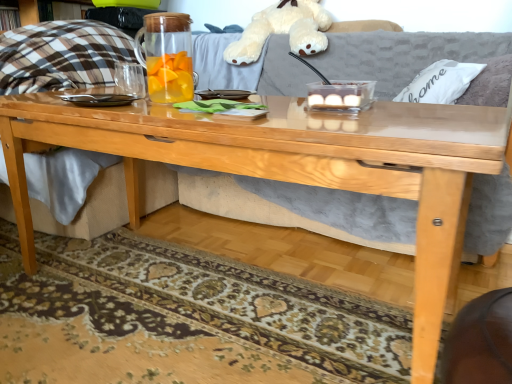
Question: Can you confirm if white plush toy at upper center is smaller than patterned carpet at lower center?

Choices:
 (A) no
 (B) yes

Answer: (A)

Question: From a real-world perspective, does white plush toy at upper center stand above patterned carpet at lower center?

Choices:
 (A) no
 (B) yes

Answer: (B)

Question: Is the depth of white plush toy at upper center greater than that of patterned carpet at lower center?

Choices:
 (A) yes
 (B) no

Answer: (A)

Question: From the image's perspective, is white plush toy at upper center located above patterned carpet at lower center?

Choices:
 (A) yes
 (B) no

Answer: (A)

Question: Is white plush toy at upper center aimed at patterned carpet at lower center?

Choices:
 (A) no
 (B) yes

Answer: (A)

Question: From their relative heights in the image, would you say white plush toy at upper center is taller or shorter than patterned carpet at lower center?

Choices:
 (A) tall
 (B) short

Answer: (A)

Question: Visually, is white plush toy at upper center positioned to the left or to the right of patterned carpet at lower center?

Choices:
 (A) right
 (B) left

Answer: (A)

Question: From a real-world perspective, relative to patterned carpet at lower center, is white plush toy at upper center vertically above or below?

Choices:
 (A) below
 (B) above

Answer: (B)

Question: Considering the positions of white plush toy at upper center and patterned carpet at lower center in the image, is white plush toy at upper center wider or thinner than patterned carpet at lower center?

Choices:
 (A) thin
 (B) wide

Answer: (A)

Question: Is point (443, 64) positioned closer to the camera than point (170, 52)?

Choices:
 (A) closer
 (B) farther

Answer: (B)

Question: Considering the positions of white fabric pillow at upper right and transparent glass pitcher at center in the image, is white fabric pillow at upper right wider or thinner than transparent glass pitcher at center?

Choices:
 (A) thin
 (B) wide

Answer: (B)

Question: From a real-world perspective, relative to transparent glass pitcher at center, is white fabric pillow at upper right vertically above or below?

Choices:
 (A) above
 (B) below

Answer: (B)

Question: Looking at the image, does white fabric pillow at upper right seem bigger or smaller compared to transparent glass pitcher at center?

Choices:
 (A) big
 (B) small

Answer: (A)

Question: Is white plush toy at upper center to the left or to the right of transparent glass pitcher at center in the image?

Choices:
 (A) right
 (B) left

Answer: (A)

Question: Does point (295, 11) appear closer or farther from the camera than point (152, 44)?

Choices:
 (A) farther
 (B) closer

Answer: (A)